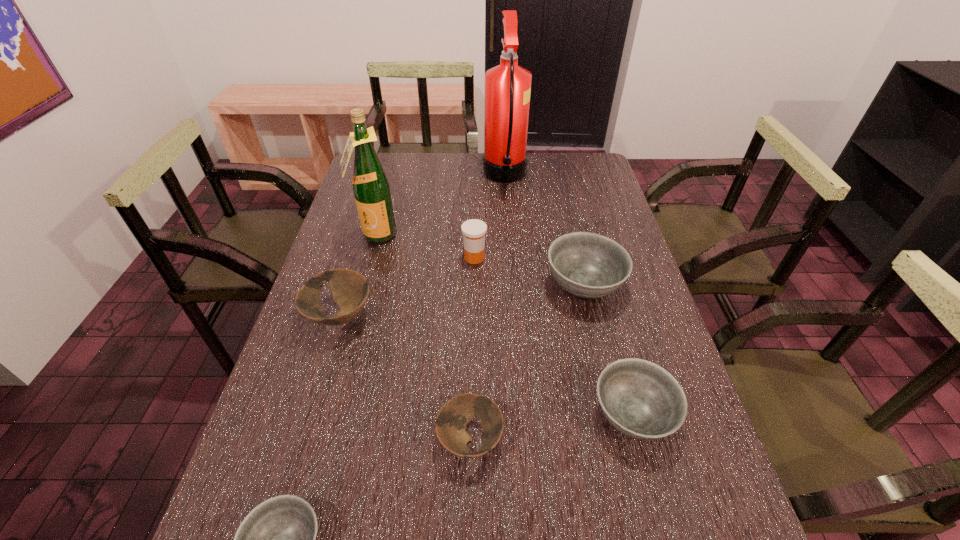
At what (x,y) coordinates should I click in order to perform the action: click on the farthest object. Please return your answer as a coordinate pair (x, y). The image size is (960, 540). Looking at the image, I should click on (507, 86).

This screenshot has height=540, width=960. I want to click on red fire extinguisher, so click(x=507, y=86).

You are a GUI agent. You are given a task and a screenshot of the screen. Output one action in this format:
    pyautogui.click(x=<x>, y=<y>)
    Task: Click on the liquor
    This screenshot has width=960, height=540.
    Given the screenshot: What is the action you would take?
    pyautogui.click(x=371, y=188)

Where is `the second farthest object`? This screenshot has height=540, width=960. the second farthest object is located at coordinates (371, 188).

You are a GUI agent. You are given a task and a screenshot of the screen. Output one action in this format:
    pyautogui.click(x=<x>, y=<y>)
    Task: Click on the orange medicine
    The height and width of the screenshot is (540, 960).
    Given the screenshot: What is the action you would take?
    pyautogui.click(x=474, y=230)

This screenshot has width=960, height=540. I want to click on the farthest gray bowl, so click(x=589, y=265).

Locate an element on the screen. This screenshot has height=540, width=960. the bigger brown bowl is located at coordinates pyautogui.click(x=350, y=290).

I want to click on the left brown bowl, so click(350, 290).

Where is `the second smallest gray bowl`? Image resolution: width=960 pixels, height=540 pixels. the second smallest gray bowl is located at coordinates (640, 399).

At what (x,y) coordinates should I click in order to perform the action: click on the right brown bowl. Please return your answer as a coordinate pair (x, y). This screenshot has height=540, width=960. Looking at the image, I should click on (455, 414).